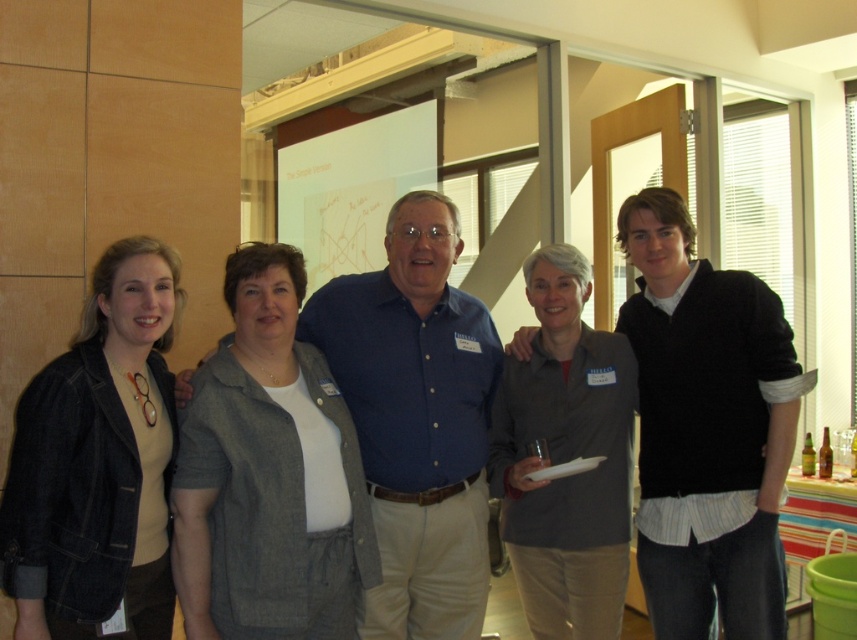
Question: Does denim jacket at left lie behind gray matte shirt at center?

Choices:
 (A) yes
 (B) no

Answer: (B)

Question: Is the position of gray fabric shirt at center more distant than that of blue button-down shirt at center?

Choices:
 (A) yes
 (B) no

Answer: (A)

Question: Based on their relative distances, which object is nearer to the gray fabric shirt at center?

Choices:
 (A) gray matte shirt at center
 (B) denim jacket at left
 (C) blue button-down shirt at center

Answer: (A)

Question: Does gray fabric shirt at center lie in front of blue button-down shirt at center?

Choices:
 (A) no
 (B) yes

Answer: (A)

Question: Among these objects, which one is nearest to the camera?

Choices:
 (A) gray matte shirt at center
 (B) blue button-down shirt at center
 (C) denim jacket at left

Answer: (C)

Question: Based on their relative distances, which object is nearer to the blue button-down shirt at center?

Choices:
 (A) denim jacket at left
 (B) gray fabric shirt at center

Answer: (A)